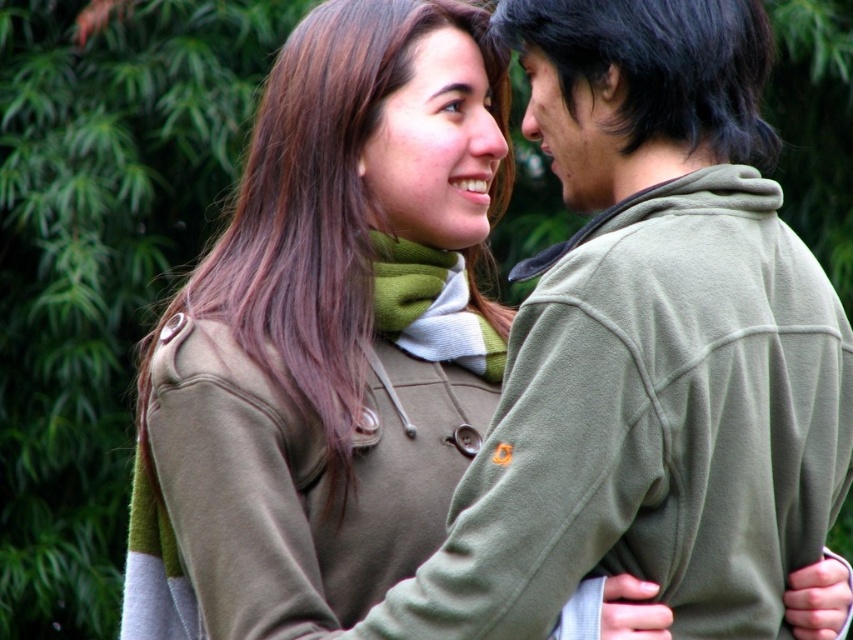
Question: Is olive green fleece at upper right thinner than matte olive green forehead at upper center?

Choices:
 (A) yes
 (B) no

Answer: (B)

Question: Is the position of olive green fleece at upper right less distant than that of matte olive green forehead at upper center?

Choices:
 (A) no
 (B) yes

Answer: (B)

Question: Which object is positioned farthest from the olive green fleece at upper right?

Choices:
 (A) matte olive green forehead at upper center
 (B) green leafy tree at upper left

Answer: (B)

Question: Can you confirm if green leafy tree at upper left is wider than olive green fleece at upper right?

Choices:
 (A) yes
 (B) no

Answer: (A)

Question: Which point is closer to the camera?

Choices:
 (A) olive green fleece at upper right
 (B) green leafy tree at upper left
 (C) matte olive green forehead at upper center

Answer: (A)

Question: Which is farther from the matte olive green forehead at upper center?

Choices:
 (A) green leafy tree at upper left
 (B) olive green fleece at upper right

Answer: (A)